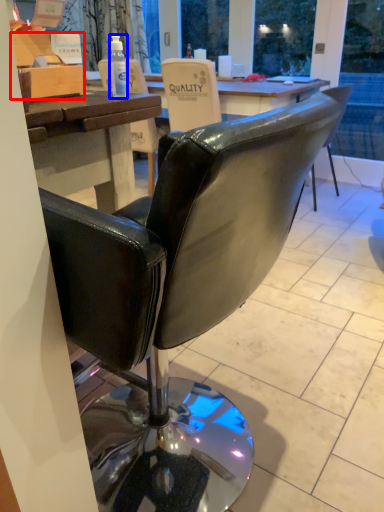
Question: Which object is further to the camera taking this photo, box (highlighted by a red box) or bottle (highlighted by a blue box)?

Choices:
 (A) box
 (B) bottle

Answer: (B)